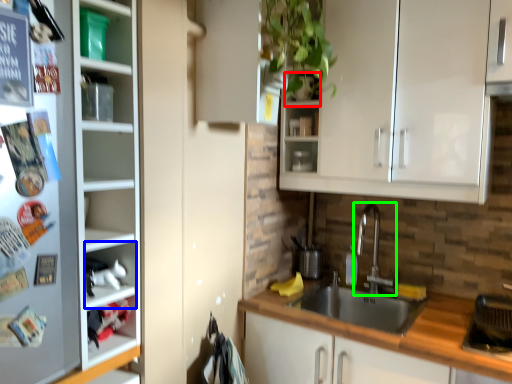
Question: Based on their relative distances, which object is nearer to shelf (highlighted by a red box)? Choose from cabinet (highlighted by a blue box) and tap (highlighted by a green box).

Choices:
 (A) cabinet
 (B) tap

Answer: (B)